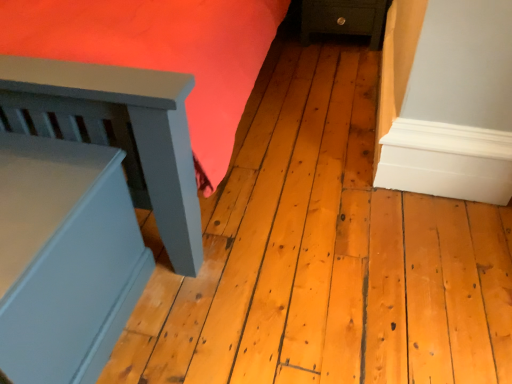
Identify the location of dark green wood nightstand at lower right, the first furniture when ordered from top to bottom. (344, 18).

The image size is (512, 384). Describe the element at coordinates (344, 18) in the screenshot. I see `dark green wood nightstand at lower right, marked as the second furniture in a bottom-to-top arrangement` at that location.

At what (x,y) coordinates should I click in order to perform the action: click on matte blue bed frame at left, the first furniture in the front-to-back sequence. Please return your answer as a coordinate pair (x, y). Looking at the image, I should click on (65, 258).

Measure the distance between point (104, 270) and camera.

Point (104, 270) and camera are 1.11 meters apart from each other.

Describe the element at coordinates (65, 258) in the screenshot. I see `matte blue bed frame at left, the second furniture positioned from the right` at that location.

Find the location of `dark green wood nightstand at lower right, the 2th furniture positioned from the front`. dark green wood nightstand at lower right, the 2th furniture positioned from the front is located at coordinates (344, 18).

Between dark green wood nightstand at lower right, arranged as the first furniture when viewed from the back, and matte blue bed frame at left, which appears as the 2th furniture when viewed from the top, which one appears on the right side from the viewer's perspective?

dark green wood nightstand at lower right, arranged as the first furniture when viewed from the back.

Relative to matte blue bed frame at left, the first furniture in the front-to-back sequence, is dark green wood nightstand at lower right, the 2th furniture positioned from the front, in front or behind?

Visually, dark green wood nightstand at lower right, the 2th furniture positioned from the front, is located behind matte blue bed frame at left, the first furniture in the front-to-back sequence.

Does point (365, 32) come farther from viewer compared to point (62, 290)?

Yes, point (365, 32) is farther from viewer.

From the image's perspective, which is below, dark green wood nightstand at lower right, which appears as the 2th furniture when viewed from the left, or matte blue bed frame at left, which appears as the first furniture when viewed from the left?

From the image's view, matte blue bed frame at left, which appears as the first furniture when viewed from the left, is below.

From a real-world perspective, which object stands above the other?

matte blue bed frame at left, the 2th furniture from the back.

Looking at their sizes, would you say dark green wood nightstand at lower right, the 2th furniture positioned from the front, is wider or thinner than matte blue bed frame at left, arranged as the first furniture when ordered from the bottom?

In the image, dark green wood nightstand at lower right, the 2th furniture positioned from the front, appears to be more narrow than matte blue bed frame at left, arranged as the first furniture when ordered from the bottom.

Considering the sizes of dark green wood nightstand at lower right, which appears as the 2th furniture when viewed from the left, and matte blue bed frame at left, the first furniture in the front-to-back sequence, in the image, is dark green wood nightstand at lower right, which appears as the 2th furniture when viewed from the left, taller or shorter than matte blue bed frame at left, the first furniture in the front-to-back sequence,?

dark green wood nightstand at lower right, which appears as the 2th furniture when viewed from the left, is shorter than matte blue bed frame at left, the first furniture in the front-to-back sequence.

Is dark green wood nightstand at lower right, the 2th furniture positioned from the front, smaller than matte blue bed frame at left, the second furniture positioned from the right?

Indeed, dark green wood nightstand at lower right, the 2th furniture positioned from the front, has a smaller size compared to matte blue bed frame at left, the second furniture positioned from the right.

Would you say dark green wood nightstand at lower right, the first furniture when ordered from top to bottom, is inside or outside matte blue bed frame at left, the first furniture in the front-to-back sequence?

dark green wood nightstand at lower right, the first furniture when ordered from top to bottom, lies outside matte blue bed frame at left, the first furniture in the front-to-back sequence.

Is dark green wood nightstand at lower right, which appears as the 2th furniture when viewed from the left, touching matte blue bed frame at left, the first furniture in the front-to-back sequence?

No, dark green wood nightstand at lower right, which appears as the 2th furniture when viewed from the left, is not with matte blue bed frame at left, the first furniture in the front-to-back sequence.

Could you tell me if dark green wood nightstand at lower right, marked as the second furniture in a bottom-to-top arrangement, is facing matte blue bed frame at left, the first furniture in the front-to-back sequence?

Yes, dark green wood nightstand at lower right, marked as the second furniture in a bottom-to-top arrangement, is aimed at matte blue bed frame at left, the first furniture in the front-to-back sequence.

Can you tell me how much dark green wood nightstand at lower right, arranged as the first furniture when viewed from the back, and matte blue bed frame at left, arranged as the first furniture when ordered from the bottom, differ in facing direction?

They differ by 1.9 degrees in their facing directions.

Locate an element on the screen. furniture above the dark green wood nightstand at lower right, which is the 1th furniture in right-to-left order (from a real-world perspective) is located at coordinates (65, 258).

Considering the relative positions of matte blue bed frame at left, the second furniture positioned from the right, and dark green wood nightstand at lower right, arranged as the first furniture when viewed from the back, in the image provided, is matte blue bed frame at left, the second furniture positioned from the right, to the left of dark green wood nightstand at lower right, arranged as the first furniture when viewed from the back, from the viewer's perspective?

Correct, you'll find matte blue bed frame at left, the second furniture positioned from the right, to the left of dark green wood nightstand at lower right, arranged as the first furniture when viewed from the back.

Considering their positions, is matte blue bed frame at left, the first furniture in the front-to-back sequence, located in front of or behind dark green wood nightstand at lower right, marked as the second furniture in a bottom-to-top arrangement?

Clearly, matte blue bed frame at left, the first furniture in the front-to-back sequence, is in front of dark green wood nightstand at lower right, marked as the second furniture in a bottom-to-top arrangement.

Which is in front, point (28, 328) or point (329, 27)?

Point (28, 328)

From the image's perspective, would you say matte blue bed frame at left, the second furniture positioned from the right, is shown under dark green wood nightstand at lower right, which appears as the 2th furniture when viewed from the left?

Indeed, from the image's perspective, matte blue bed frame at left, the second furniture positioned from the right, is shown beneath dark green wood nightstand at lower right, which appears as the 2th furniture when viewed from the left.

From a real-world perspective, is matte blue bed frame at left, the 2th furniture from the back, above or below dark green wood nightstand at lower right, which is the 1th furniture in right-to-left order?

From a real-world perspective, matte blue bed frame at left, the 2th furniture from the back, is physically above dark green wood nightstand at lower right, which is the 1th furniture in right-to-left order.

Considering the relative sizes of matte blue bed frame at left, the first furniture in the front-to-back sequence, and dark green wood nightstand at lower right, the first furniture when ordered from top to bottom, in the image provided, is matte blue bed frame at left, the first furniture in the front-to-back sequence, thinner than dark green wood nightstand at lower right, the first furniture when ordered from top to bottom,?

No, matte blue bed frame at left, the first furniture in the front-to-back sequence, is not thinner than dark green wood nightstand at lower right, the first furniture when ordered from top to bottom.

Does matte blue bed frame at left, the second furniture positioned from the right, have a lesser height compared to dark green wood nightstand at lower right, arranged as the first furniture when viewed from the back?

No.

Who is smaller, matte blue bed frame at left, which appears as the first furniture when viewed from the left, or dark green wood nightstand at lower right, arranged as the first furniture when viewed from the back?

dark green wood nightstand at lower right, arranged as the first furniture when viewed from the back, is smaller.

Can dark green wood nightstand at lower right, which appears as the 2th furniture when viewed from the left, be found inside matte blue bed frame at left, which appears as the first furniture when viewed from the left?

That's incorrect, dark green wood nightstand at lower right, which appears as the 2th furniture when viewed from the left, is not inside matte blue bed frame at left, which appears as the first furniture when viewed from the left.

Is matte blue bed frame at left, which appears as the 2th furniture when viewed from the top, next to dark green wood nightstand at lower right, which appears as the 2th furniture when viewed from the left, and touching it?

matte blue bed frame at left, which appears as the 2th furniture when viewed from the top, is not next to dark green wood nightstand at lower right, which appears as the 2th furniture when viewed from the left, and they're not touching.

Is matte blue bed frame at left, the first furniture in the front-to-back sequence, aimed at dark green wood nightstand at lower right, which is the 1th furniture in right-to-left order?

No, matte blue bed frame at left, the first furniture in the front-to-back sequence, is not aimed at dark green wood nightstand at lower right, which is the 1th furniture in right-to-left order.

Where is `furniture located above the matte blue bed frame at left, the 2th furniture from the back (from the image's perspective)`? furniture located above the matte blue bed frame at left, the 2th furniture from the back (from the image's perspective) is located at coordinates (344, 18).

Find the location of a particular element. furniture above the dark green wood nightstand at lower right, arranged as the first furniture when viewed from the back (from a real-world perspective) is located at coordinates (65, 258).

Find the location of a particular element. Image resolution: width=512 pixels, height=384 pixels. furniture behind the matte blue bed frame at left, which appears as the 2th furniture when viewed from the top is located at coordinates (344, 18).